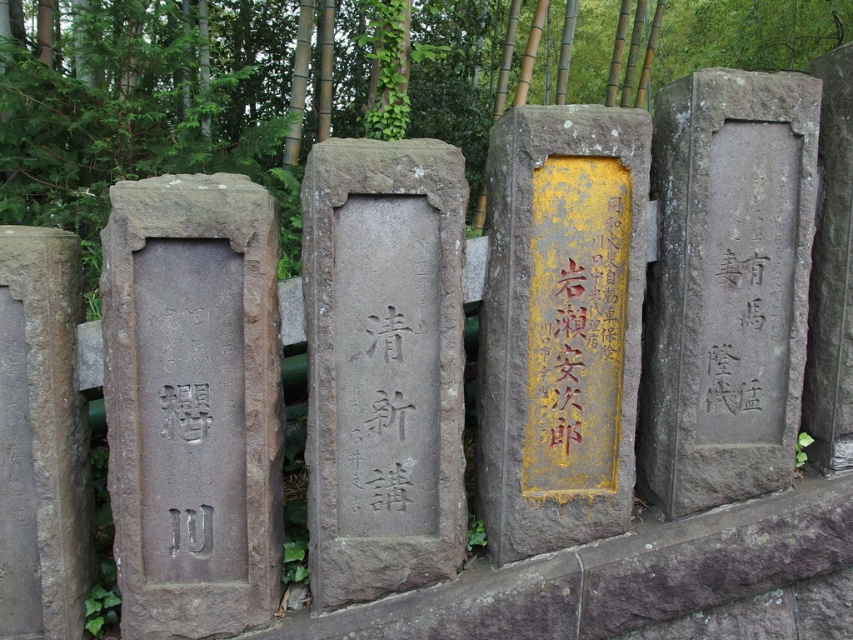
Question: Which of the following is the farthest from the observer?

Choices:
 (A) brown stone plaque at center
 (B) brown stone gravestone at left

Answer: (A)

Question: Does brown stone gravestone at left have a smaller size compared to yellow/golden stone plaque at center?

Choices:
 (A) no
 (B) yes

Answer: (B)

Question: Which point is farther to the camera?

Choices:
 (A) brown stone plaque at center
 (B) brown stone gravestone at left

Answer: (A)

Question: Where is brown stone gravestone at left located in relation to gray stone plaque at right in the image?

Choices:
 (A) left
 (B) right

Answer: (A)

Question: Which object is farther from the camera taking this photo?

Choices:
 (A) brown stone plaque at center
 (B) brown stone gravestone at left

Answer: (A)

Question: Can you confirm if brown stone gravestone at left is positioned to the left of yellow painted stone at center?

Choices:
 (A) yes
 (B) no

Answer: (A)